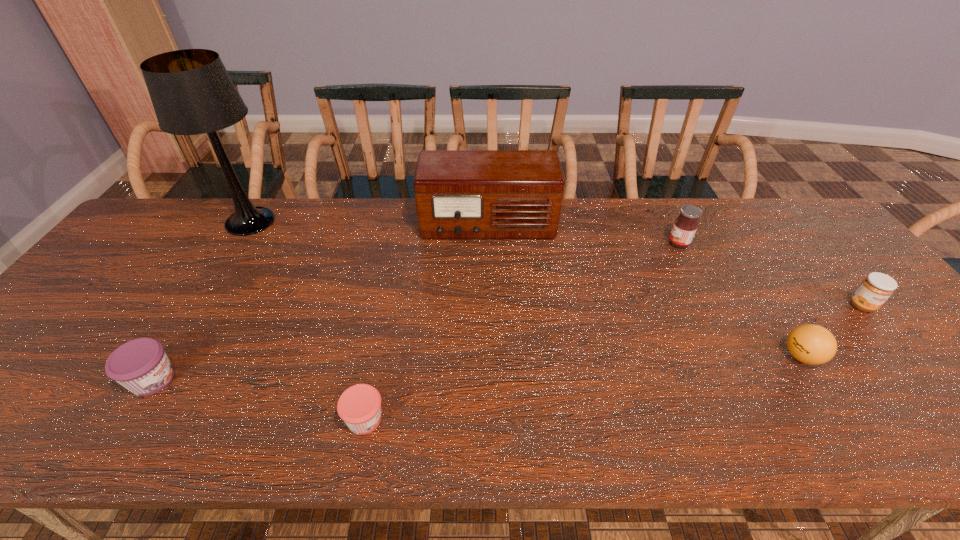
I want to click on vacant space at the far left corner of the desktop, so click(166, 237).

At what (x,y) coordinates should I click in order to perform the action: click on vacant space at the far right corner of the desktop. Please return your answer as a coordinate pair (x, y). Image resolution: width=960 pixels, height=540 pixels. Looking at the image, I should click on (780, 211).

The height and width of the screenshot is (540, 960). In the image, there is a desktop. What are the coordinates of `vacant space at the near right corner` in the screenshot? It's located at (942, 433).

This screenshot has height=540, width=960. What are the coordinates of `vacant area that lies between the radio receiver and the third tallest object` in the screenshot? It's located at (584, 234).

Find the location of `free space between the leftmost jam and the table lamp`. free space between the leftmost jam and the table lamp is located at coordinates (202, 301).

Locate an element on the screen. This screenshot has width=960, height=540. vacant space that is in between the sixth object from left to right and the shortest jam is located at coordinates (583, 388).

Where is `empty location between the third jam from right to left and the radio receiver`? This screenshot has width=960, height=540. empty location between the third jam from right to left and the radio receiver is located at coordinates (426, 322).

Where is `vacant area that lies between the shortest object and the rightmost object`? vacant area that lies between the shortest object and the rightmost object is located at coordinates (613, 362).

This screenshot has height=540, width=960. In order to click on vacant area that lies between the leftmost jam and the tallest jam in this screenshot , I will do `click(416, 312)`.

At what (x,y) coordinates should I click in order to perform the action: click on blank region between the table lamp and the leftmost jam. Please return your answer as a coordinate pair (x, y). Image resolution: width=960 pixels, height=540 pixels. Looking at the image, I should click on (202, 301).